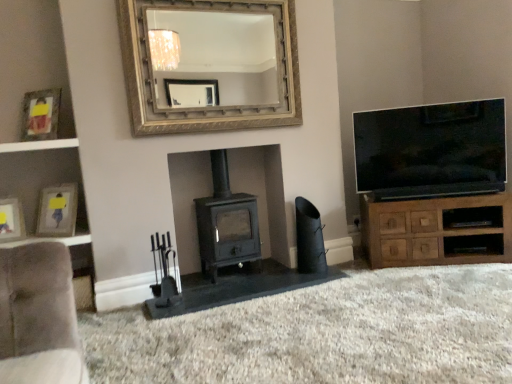
Find the location of `vacant space that is to the left of black matte speaker at lower right`. vacant space that is to the left of black matte speaker at lower right is located at coordinates (283, 276).